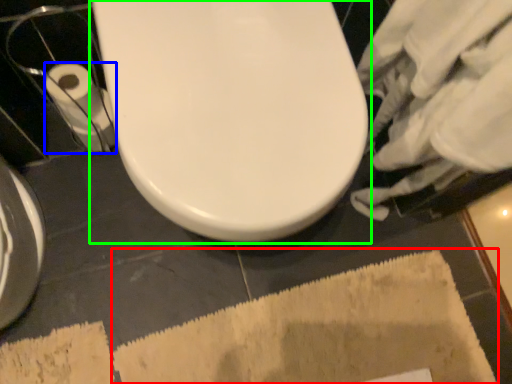
Question: Based on their relative distances, which object is farther from bath mat (highlighted by a red box)? Choose from toilet paper (highlighted by a blue box) and toilet (highlighted by a green box).

Choices:
 (A) toilet paper
 (B) toilet

Answer: (A)